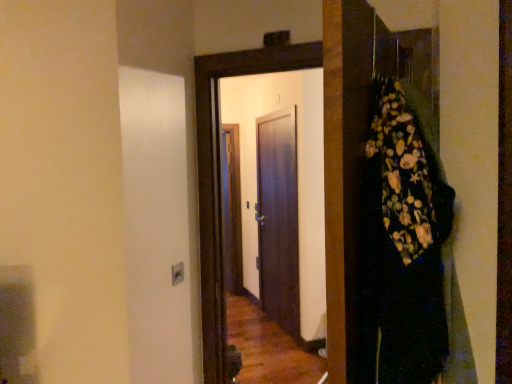
Question: From the image's perspective, would you say dark wood door at center, the first door in the back-to-front sequence, is positioned over dark wood door at center, acting as the second door starting from the back?

Choices:
 (A) no
 (B) yes

Answer: (A)

Question: Considering the relative positions of dark wood door at center, the first door in the back-to-front sequence, and dark wood door at center, the first door viewed from the front, in the image provided, is dark wood door at center, the first door in the back-to-front sequence, to the left of dark wood door at center, the first door viewed from the front, from the viewer's perspective?

Choices:
 (A) yes
 (B) no

Answer: (B)

Question: From the image's perspective, is dark wood door at center, which is counted as the 2th door, starting from the front, under dark wood door at center, acting as the second door starting from the back?

Choices:
 (A) yes
 (B) no

Answer: (A)

Question: Is dark wood door at center, the first door viewed from the front, a part of dark wood door at center, which is counted as the 2th door, starting from the front?

Choices:
 (A) no
 (B) yes

Answer: (A)

Question: Is dark wood door at center, which is counted as the 2th door, starting from the front, further to camera compared to dark wood door at center, acting as the second door starting from the back?

Choices:
 (A) yes
 (B) no

Answer: (A)

Question: From a real-world perspective, is dark wood door at center, which is counted as the 2th door, starting from the front, physically below dark wood door at center, acting as the second door starting from the back?

Choices:
 (A) yes
 (B) no

Answer: (A)

Question: Is dark wood door at center, acting as the second door starting from the back, facing towards floral-patterned fabric at right?

Choices:
 (A) no
 (B) yes

Answer: (A)

Question: Considering the relative sizes of dark wood door at center, acting as the second door starting from the back, and floral-patterned fabric at right in the image provided, is dark wood door at center, acting as the second door starting from the back, wider than floral-patterned fabric at right?

Choices:
 (A) yes
 (B) no

Answer: (B)

Question: Does dark wood door at center, the first door viewed from the front, have a smaller size compared to floral-patterned fabric at right?

Choices:
 (A) yes
 (B) no

Answer: (A)

Question: Can you confirm if dark wood door at center, acting as the second door starting from the back, is shorter than floral-patterned fabric at right?

Choices:
 (A) no
 (B) yes

Answer: (A)

Question: Is dark wood door at center, the first door viewed from the front, beside floral-patterned fabric at right?

Choices:
 (A) no
 (B) yes

Answer: (A)

Question: From the image's perspective, is dark wood door at center, acting as the second door starting from the back, beneath floral-patterned fabric at right?

Choices:
 (A) no
 (B) yes

Answer: (B)

Question: Is floral-patterned fabric at right a part of dark wood door at center, which is counted as the 2th door, starting from the front?

Choices:
 (A) no
 (B) yes

Answer: (A)